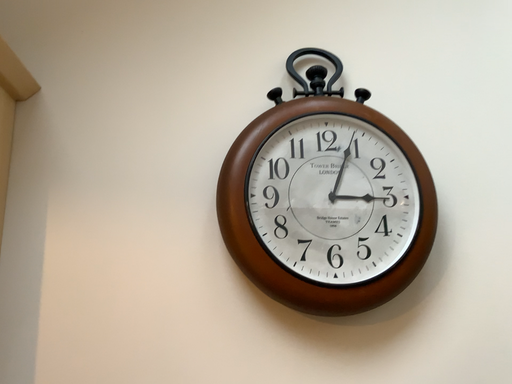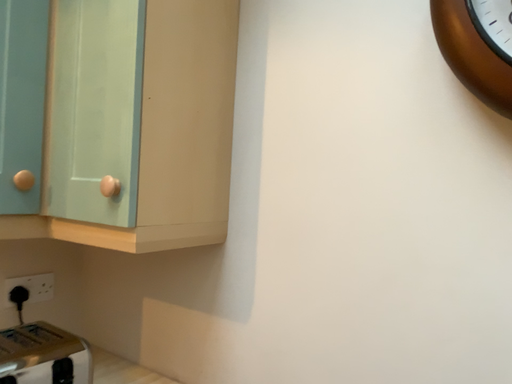
Question: Which way did the camera rotate in the video?

Choices:
 (A) rotated downward
 (B) rotated upward

Answer: (A)